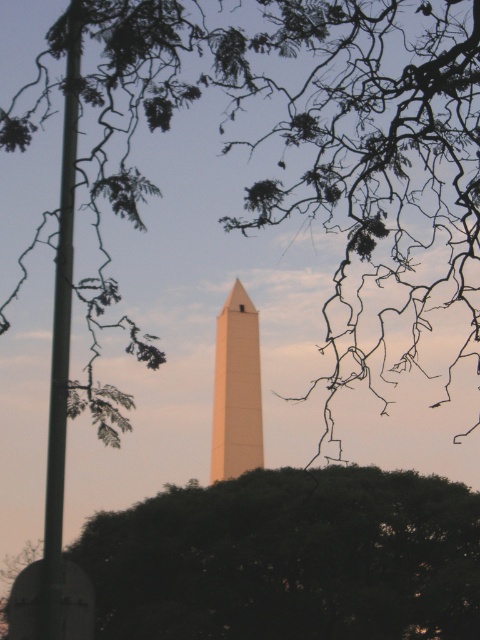
Question: Which object is positioned farthest from the green leafy tree at center?

Choices:
 (A) green leafy tree at upper center
 (B) smooth beige obelisk at center

Answer: (B)

Question: Which point appears closest to the camera in this image?

Choices:
 (A) (217, 401)
 (B) (383, 273)
 (C) (296, 609)

Answer: (B)

Question: Is green leafy tree at upper center positioned at the back of green leafy tree at center?

Choices:
 (A) no
 (B) yes

Answer: (A)

Question: Can you confirm if green leafy tree at upper center is smaller than smooth beige obelisk at center?

Choices:
 (A) yes
 (B) no

Answer: (B)

Question: Among these objects, which one is nearest to the camera?

Choices:
 (A) green leafy tree at center
 (B) green leafy tree at upper center

Answer: (B)

Question: Can you confirm if green leafy tree at upper center is wider than green leafy tree at center?

Choices:
 (A) yes
 (B) no

Answer: (A)